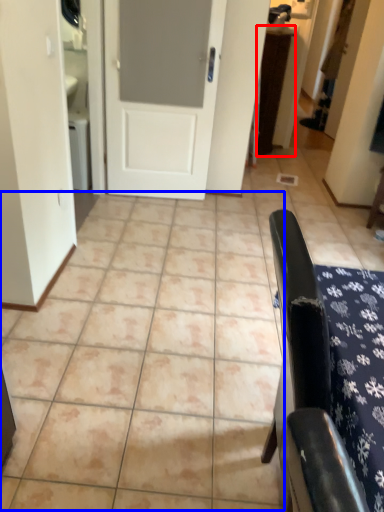
Question: Which of the following is the farthest to the observer, table (highlighted by a red box) or ceramic tile (highlighted by a blue box)?

Choices:
 (A) table
 (B) ceramic tile

Answer: (A)